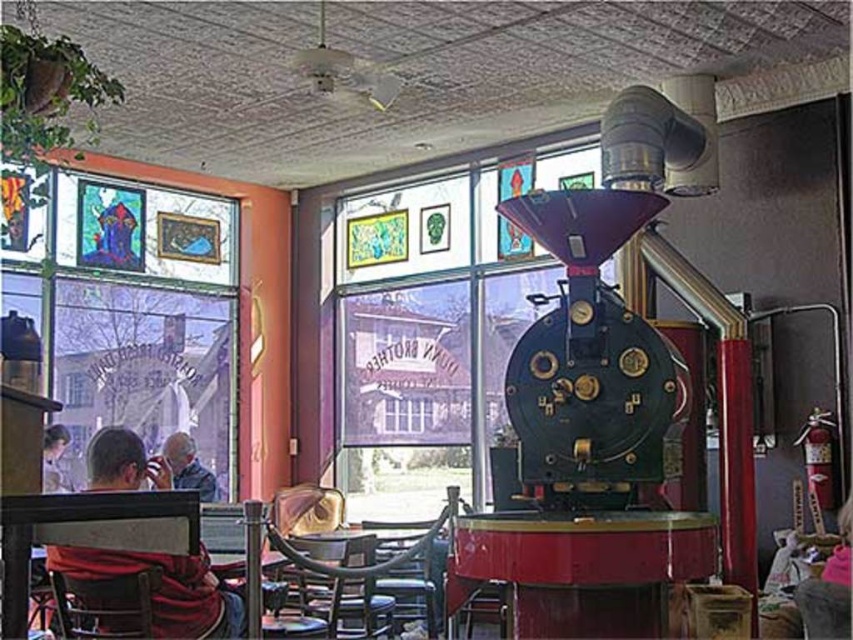
Question: Observing the image, what is the correct spatial positioning of wooden table at center in reference to gray fabric jacket at lower left?

Choices:
 (A) below
 (B) above

Answer: (A)

Question: Based on their relative distances, which object is farther from the wooden chair at lower left?

Choices:
 (A) transparent glass window at center
 (B) wooden chair at center
 (C) shiny dark blue metal coffee grinder at center

Answer: (A)

Question: Does pink fabric at lower right have a smaller size compared to gray fabric jacket at lower left?

Choices:
 (A) yes
 (B) no

Answer: (A)

Question: Which is farther from the wooden chair at center?

Choices:
 (A) wooden table at center
 (B) transparent glass window at center

Answer: (B)

Question: Which object is positioned farthest from the smooth gray shirt at lower left?

Choices:
 (A) red sweater at left
 (B) shiny dark blue metal coffee grinder at center

Answer: (B)

Question: Does shiny dark blue metal coffee grinder at center have a greater width compared to red sweater at left?

Choices:
 (A) no
 (B) yes

Answer: (B)